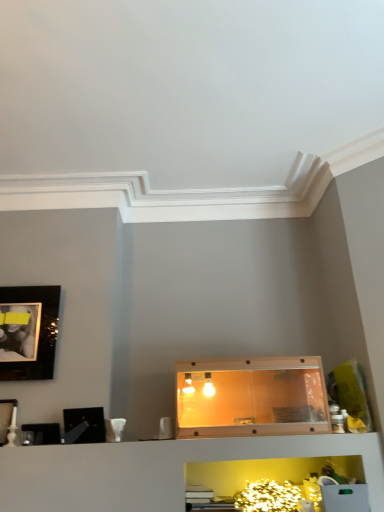
Question: From a real-world perspective, is translucent plastic cabinet at center physically above matte black picture frame at upper left, marked as the 4th picture frame in a bottom-to-top arrangement?

Choices:
 (A) yes
 (B) no

Answer: (B)

Question: Considering the relative positions of translucent plastic cabinet at center and matte black picture frame at upper left, marked as the 4th picture frame in a bottom-to-top arrangement, in the image provided, is translucent plastic cabinet at center to the left of matte black picture frame at upper left, marked as the 4th picture frame in a bottom-to-top arrangement, from the viewer's perspective?

Choices:
 (A) no
 (B) yes

Answer: (A)

Question: Does translucent plastic cabinet at center have a lesser height compared to matte black picture frame at upper left, positioned as the 1th picture frame in top-to-bottom order?

Choices:
 (A) yes
 (B) no

Answer: (A)

Question: Does translucent plastic cabinet at center have a greater width compared to matte black picture frame at upper left, marked as the 4th picture frame in a bottom-to-top arrangement?

Choices:
 (A) yes
 (B) no

Answer: (A)

Question: Would you say translucent plastic cabinet at center is a long distance from matte black picture frame at upper left, positioned as the 1th picture frame in top-to-bottom order?

Choices:
 (A) yes
 (B) no

Answer: (A)

Question: Considering the relative positions of translucent plastic cabinet at center and matte black picture frame at upper left, positioned as the 1th picture frame in top-to-bottom order, in the image provided, is translucent plastic cabinet at center to the right of matte black picture frame at upper left, positioned as the 1th picture frame in top-to-bottom order, from the viewer's perspective?

Choices:
 (A) yes
 (B) no

Answer: (A)

Question: From a real-world perspective, is matte black picture frame at left, which is counted as the 3th picture frame, starting from the top, beneath matte black picture frame at lower left, marked as the 1th picture frame in a bottom-to-top arrangement?

Choices:
 (A) yes
 (B) no

Answer: (B)

Question: From the image's perspective, is matte black picture frame at left, placed as the 2th picture frame when sorted from bottom to top, on top of matte black picture frame at lower left, marked as the 1th picture frame in a bottom-to-top arrangement?

Choices:
 (A) yes
 (B) no

Answer: (A)

Question: Is matte black picture frame at left, which is counted as the 3th picture frame, starting from the top, oriented towards matte black picture frame at lower left, marked as the 1th picture frame in a bottom-to-top arrangement?

Choices:
 (A) no
 (B) yes

Answer: (A)

Question: From the image's perspective, is matte black picture frame at left, which is counted as the 3th picture frame, starting from the top, located beneath matte black picture frame at lower left, the 4th picture frame when ordered from top to bottom?

Choices:
 (A) no
 (B) yes

Answer: (A)

Question: Does matte black picture frame at left, which is counted as the 3th picture frame, starting from the top, appear on the left side of matte black picture frame at lower left, marked as the 1th picture frame in a bottom-to-top arrangement?

Choices:
 (A) yes
 (B) no

Answer: (A)

Question: Does matte black picture frame at left, which is counted as the 3th picture frame, starting from the top, have a lesser width compared to matte black picture frame at lower left, marked as the 1th picture frame in a bottom-to-top arrangement?

Choices:
 (A) no
 (B) yes

Answer: (A)

Question: Does black glossy picture frame at left, marked as the third picture frame in a bottom-to-top arrangement, have a greater height compared to translucent plastic cabinet at center?

Choices:
 (A) yes
 (B) no

Answer: (B)